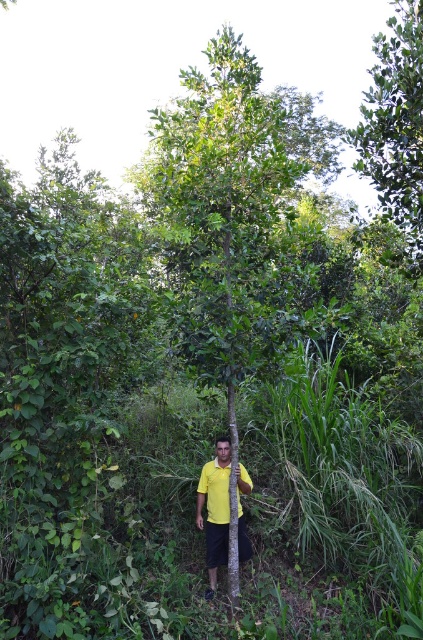
Question: Can you confirm if green leafy tree at upper right is thinner than yellow matte shirt at center?

Choices:
 (A) no
 (B) yes

Answer: (A)

Question: Does green leafy tree at upper right appear over yellow matte shirt at center?

Choices:
 (A) yes
 (B) no

Answer: (A)

Question: Which object is the farthest from the green leafy tree at upper right?

Choices:
 (A) yellow matte shirt at center
 (B) green matte tree at center

Answer: (A)

Question: Which point is closer to the camera?

Choices:
 (A) (197, 307)
 (B) (400, 88)
 (C) (244, 545)

Answer: (A)

Question: Which is nearer to the yellow matte shirt at center?

Choices:
 (A) green matte tree at center
 (B) green leafy tree at upper right

Answer: (A)

Question: Is green matte tree at center to the right of yellow matte shirt at center from the viewer's perspective?

Choices:
 (A) no
 (B) yes

Answer: (B)